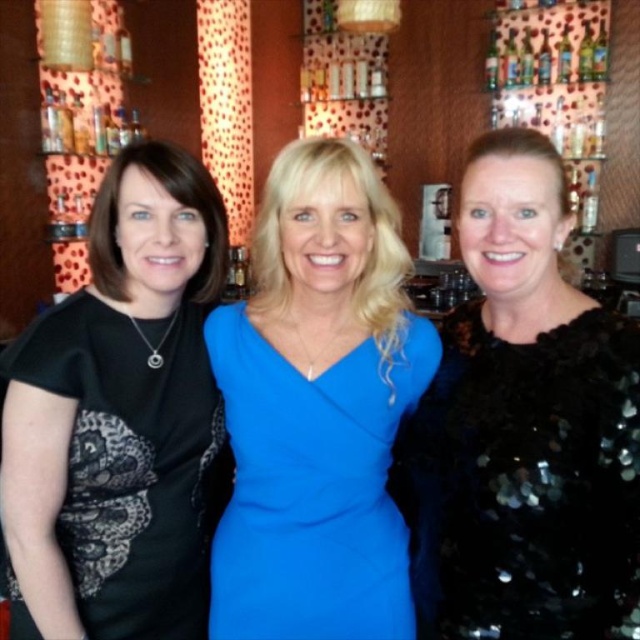
Which of these two, black sequined dress at right or black matte shirt at left, stands taller?

Standing taller between the two is black sequined dress at right.

Who is positioned more to the right, black sequined dress at right or black matte shirt at left?

black sequined dress at right is more to the right.

Find the location of a particular element. The width and height of the screenshot is (640, 640). black sequined dress at right is located at coordinates (524, 426).

Between black matte shirt at left and royal blue fabric dress at center, which one appears on the right side from the viewer's perspective?

From the viewer's perspective, royal blue fabric dress at center appears more on the right side.

Who is positioned more to the left, black matte shirt at left or royal blue fabric dress at center?

black matte shirt at left

Which is behind, point (188, 310) or point (324, 433)?

Point (188, 310)

I want to click on black matte shirt at left, so click(x=118, y=417).

Is point (637, 525) positioned behind point (369, 593)?

No, it is in front of (369, 593).

Which is above, black sequined dress at right or royal blue fabric dress at center?

black sequined dress at right

Who is more forward, (572, 460) or (224, 321)?

Positioned in front is point (572, 460).

Where is `black sequined dress at right`? This screenshot has width=640, height=640. black sequined dress at right is located at coordinates (524, 426).